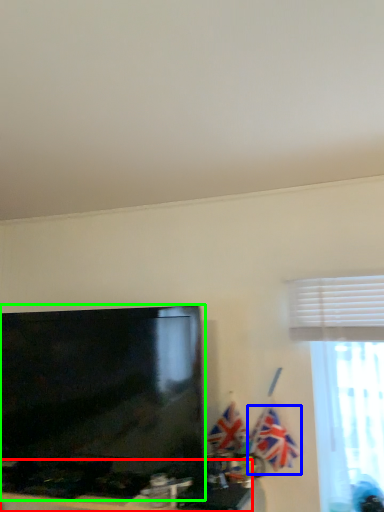
Question: Which object is the farthest from furniture (highlighted by a red box)? Choose among these: flag (highlighted by a blue box) or television (highlighted by a green box).

Choices:
 (A) flag
 (B) television

Answer: (A)